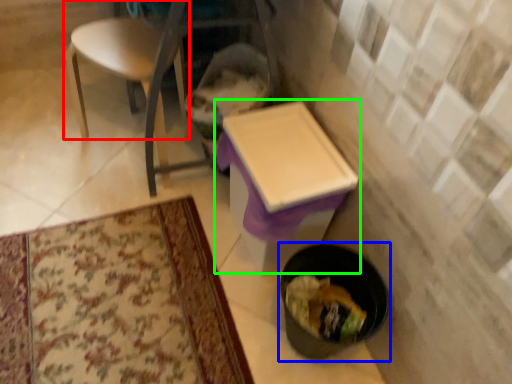
Question: Which object is positioned closest to chair (highlighted by a red box)? Select from potty (highlighted by a blue box) and table (highlighted by a green box).

Choices:
 (A) potty
 (B) table

Answer: (B)